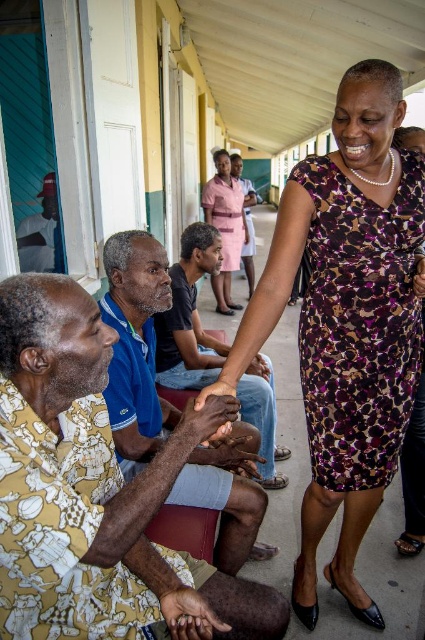
Question: Is brown textured shirt at lower left positioned behind matte pink dress at center?

Choices:
 (A) yes
 (B) no

Answer: (B)

Question: Which is nearer to the brown leather shoes at center?

Choices:
 (A) brown textured shirt at lower left
 (B) purple printed dress at center

Answer: (A)

Question: Does brown leather shoes at center have a lesser width compared to matte pink dress at center?

Choices:
 (A) no
 (B) yes

Answer: (A)

Question: Is brown textured shirt at lower left thinner than brown leather shoes at center?

Choices:
 (A) yes
 (B) no

Answer: (A)

Question: Based on their relative distances, which object is farther from the brown leather shoes at center?

Choices:
 (A) matte pink dress at center
 (B) pink fabric dress at center

Answer: (B)

Question: Among these objects, which one is nearest to the camera?

Choices:
 (A) purple printed dress at center
 (B) brown leather shoes at center

Answer: (A)